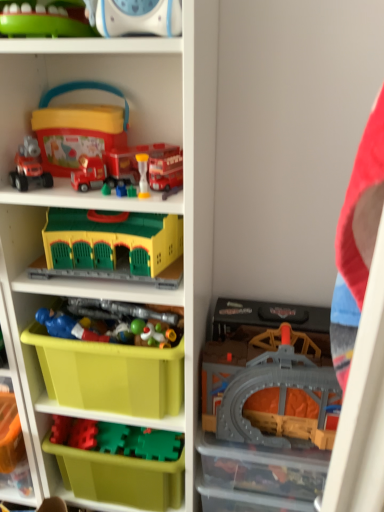
Question: From the image's perspective, does translucent plastic toy at center, which appears as the 4th toy when viewed from the top, appear lower than blue plastic figure at center, positioned as the third toy in bottom-to-top order?

Choices:
 (A) no
 (B) yes

Answer: (A)

Question: Does translucent plastic toy at center, acting as the 4th toy starting from the bottom, turn towards blue plastic figure at center, the fifth toy from the top?

Choices:
 (A) no
 (B) yes

Answer: (B)

Question: Is translucent plastic toy at center, which appears as the 4th toy when viewed from the top, positioned in front of blue plastic figure at center, positioned as the third toy in bottom-to-top order?

Choices:
 (A) yes
 (B) no

Answer: (B)

Question: Can you confirm if translucent plastic toy at center, acting as the 4th toy starting from the bottom, is wider than blue plastic figure at center, the fifth toy from the top?

Choices:
 (A) yes
 (B) no

Answer: (A)

Question: Can you confirm if translucent plastic toy at center, acting as the 4th toy starting from the bottom, is thinner than blue plastic figure at center, the fifth toy from the top?

Choices:
 (A) no
 (B) yes

Answer: (A)

Question: In the image, is translucent plastic tunnel at lower right, which is counted as the first storage box, starting from the right, positioned in front of or behind translucent plastic toy at center, which appears as the 4th toy when viewed from the top?

Choices:
 (A) front
 (B) behind

Answer: (B)

Question: From the image's perspective, is translucent plastic tunnel at lower right, which is counted as the first storage box, starting from the right, above or below translucent plastic toy at center, which appears as the 4th toy when viewed from the top?

Choices:
 (A) below
 (B) above

Answer: (A)

Question: Considering the positions of point (317, 458) and point (130, 340), is point (317, 458) closer or farther from the camera than point (130, 340)?

Choices:
 (A) farther
 (B) closer

Answer: (A)

Question: Is translucent plastic tunnel at lower right, positioned as the second storage box in left-to-right order, wider or thinner than translucent plastic toy at center, which appears as the 4th toy when viewed from the top?

Choices:
 (A) wide
 (B) thin

Answer: (A)

Question: Considering the relative positions of matte red truck at upper left, arranged as the 1th toy when viewed from the top, and green plastic bin at lower left in the image provided, is matte red truck at upper left, arranged as the 1th toy when viewed from the top, to the left or to the right of green plastic bin at lower left?

Choices:
 (A) left
 (B) right

Answer: (B)

Question: In the image, is matte red truck at upper left, arranged as the 1th toy when viewed from the top, positioned in front of or behind green plastic bin at lower left?

Choices:
 (A) front
 (B) behind

Answer: (A)

Question: Looking at the image, does matte red truck at upper left, arranged as the 1th toy when viewed from the top, seem bigger or smaller compared to green plastic bin at lower left?

Choices:
 (A) big
 (B) small

Answer: (B)

Question: From their relative heights in the image, would you say matte red truck at upper left, the seventh toy when ordered from bottom to top, is taller or shorter than green plastic bin at lower left?

Choices:
 (A) tall
 (B) short

Answer: (B)

Question: Considering the positions of yellow plastic building at center, the 3th toy in the top-to-bottom sequence, and translucent plastic tunnel at lower right, which is counted as the first storage box, starting from the right, in the image, is yellow plastic building at center, the 3th toy in the top-to-bottom sequence, taller or shorter than translucent plastic tunnel at lower right, which is counted as the first storage box, starting from the right,?

Choices:
 (A) short
 (B) tall

Answer: (B)

Question: Considering the positions of point (51, 259) and point (306, 478), is point (51, 259) closer or farther from the camera than point (306, 478)?

Choices:
 (A) closer
 (B) farther

Answer: (A)